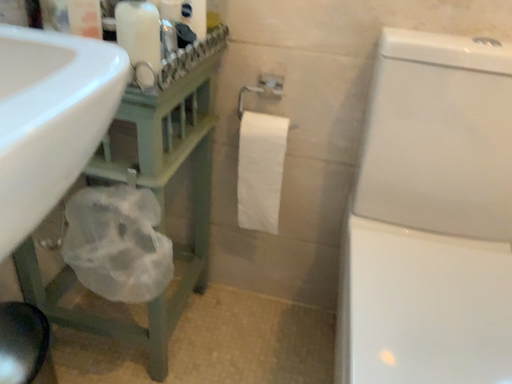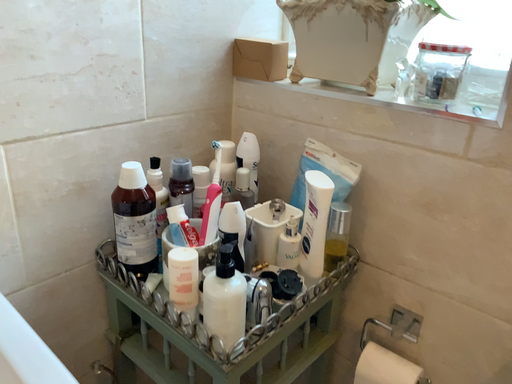
Question: How did the camera likely rotate when shooting the video?

Choices:
 (A) rotated downward
 (B) rotated upward

Answer: (B)